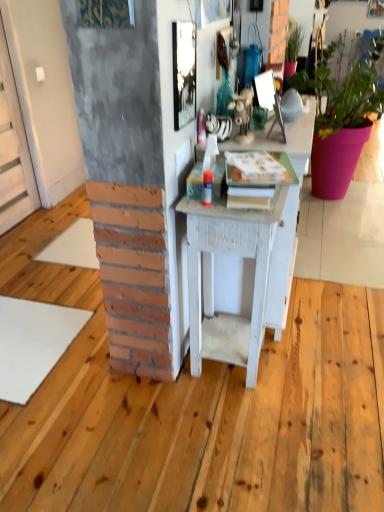
Question: Would you say metallic textured picture frame at upper center, arranged as the 1th picture frame when viewed from the front, is a long distance from matte pink pot at right, placed as the first houseplant when sorted from right to left?

Choices:
 (A) no
 (B) yes

Answer: (B)

Question: Does metallic textured picture frame at upper center, the 2th picture frame positioned from the right, have a larger size compared to matte pink pot at right, positioned as the 2th houseplant in left-to-right order?

Choices:
 (A) yes
 (B) no

Answer: (B)

Question: Is metallic textured picture frame at upper center, which is counted as the 2th picture frame, starting from the back, positioned with its back to matte pink pot at right, placed as the first houseplant when sorted from right to left?

Choices:
 (A) yes
 (B) no

Answer: (B)

Question: Does metallic textured picture frame at upper center, positioned as the first picture frame in left-to-right order, have a smaller size compared to matte pink pot at right, positioned as the 2th houseplant in left-to-right order?

Choices:
 (A) yes
 (B) no

Answer: (A)

Question: Can you confirm if metallic textured picture frame at upper center, which is counted as the 2th picture frame, starting from the back, is positioned to the right of matte pink pot at right, placed as the first houseplant when sorted from right to left?

Choices:
 (A) no
 (B) yes

Answer: (A)

Question: Is metallic textured picture frame at upper center, positioned as the first picture frame in left-to-right order, outside of matte pink pot at right, positioned as the 2th houseplant in left-to-right order?

Choices:
 (A) no
 (B) yes

Answer: (B)

Question: From the image's perspective, would you say white painted wood desk at center is shown under metallic textured picture frame at upper center, arranged as the 1th picture frame when viewed from the front?

Choices:
 (A) yes
 (B) no

Answer: (A)

Question: Can you confirm if white painted wood desk at center is shorter than metallic textured picture frame at upper center, which is counted as the 2th picture frame, starting from the back?

Choices:
 (A) no
 (B) yes

Answer: (A)

Question: Does white painted wood desk at center contain metallic textured picture frame at upper center, arranged as the 1th picture frame when viewed from the front?

Choices:
 (A) yes
 (B) no

Answer: (B)

Question: Is white painted wood desk at center to the left of metallic textured picture frame at upper center, arranged as the 1th picture frame when viewed from the front, from the viewer's perspective?

Choices:
 (A) yes
 (B) no

Answer: (B)

Question: Can you confirm if white painted wood desk at center is wider than metallic textured picture frame at upper center, the 2th picture frame positioned from the right?

Choices:
 (A) no
 (B) yes

Answer: (B)

Question: Is white painted wood desk at center outside metallic textured picture frame at upper center, which is counted as the 2th picture frame, starting from the back?

Choices:
 (A) yes
 (B) no

Answer: (A)

Question: Does metallic reflective mirror at upper center, positioned as the 1th picture frame in back-to-front order, have a lesser height compared to green matte plant at upper right, the 2th houseplant positioned from the right?

Choices:
 (A) no
 (B) yes

Answer: (B)